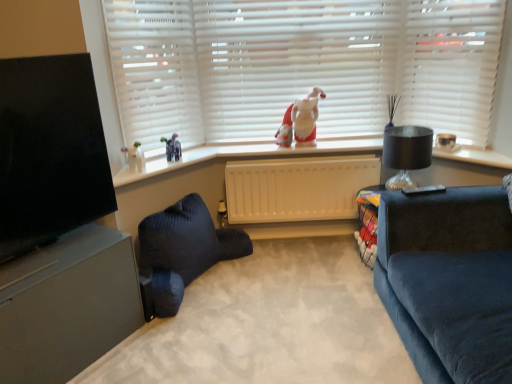
What do you see at coordinates (452, 66) in the screenshot? The width and height of the screenshot is (512, 384). I see `white matte blinds at upper center, which is counted as the second blind, starting from the left` at bounding box center [452, 66].

The height and width of the screenshot is (384, 512). I want to click on dark blue fabric studio couch at lower center, so click(x=182, y=252).

The image size is (512, 384). What do you see at coordinates (182, 252) in the screenshot?
I see `dark blue fabric studio couch at lower center` at bounding box center [182, 252].

Locate an element on the screen. white fabric santa at center is located at coordinates (300, 120).

What do you see at coordinates (297, 188) in the screenshot? I see `beige plastic radiator at center` at bounding box center [297, 188].

What are the coordinates of `white matte blinds at upper center, the first blind from the right` in the screenshot? It's located at (452, 66).

Is point (137, 108) farther from viewer compared to point (189, 331)?

Yes.

Between white matte blinds at upper left and velvet dark blue pillow at lower left, which one appears on the right side from the viewer's perspective?

Positioned to the right is velvet dark blue pillow at lower left.

Are white matte blinds at upper left and velvet dark blue pillow at lower left located far from each other?

Yes, white matte blinds at upper left and velvet dark blue pillow at lower left are located far from each other.

Based on the photo, relative to velvet dark blue pillow at lower left, is white matte blinds at upper left in front or behind?

Visually, white matte blinds at upper left is located behind velvet dark blue pillow at lower left.

Is white matte blinds at upper center, the first blind from the right, next to velvet dark blue pillow at lower left?

No, white matte blinds at upper center, the first blind from the right, is not with velvet dark blue pillow at lower left.

Between white matte blinds at upper center, which is counted as the second blind, starting from the left, and velvet dark blue pillow at lower left, which one has more height?

white matte blinds at upper center, which is counted as the second blind, starting from the left.

Considering the sizes of white matte blinds at upper center, the first blind from the right, and velvet dark blue pillow at lower left in the image, is white matte blinds at upper center, the first blind from the right, bigger or smaller than velvet dark blue pillow at lower left?

Considering their sizes, white matte blinds at upper center, the first blind from the right, takes up less space than velvet dark blue pillow at lower left.

Is there a large distance between dark blue fabric studio couch at lower center and black glass lampshade at right?

Yes.

Can you confirm if dark blue fabric studio couch at lower center is positioned to the left of black glass lampshade at right?

Yes.

Is black glossy tv at left far from matte gray entertainment center at lower left?

They are positioned close to each other.

Which is in front, black glossy tv at left or matte gray entertainment center at lower left?

black glossy tv at left is more forward.

Is matte gray entertainment center at lower left surrounded by black glossy tv at left?

No, matte gray entertainment center at lower left is not a part of black glossy tv at left.

Identify the location of toy located behind the white matte blinds at upper center, which is counted as the second blind, starting from the left. The width and height of the screenshot is (512, 384). (300, 120).

Is white matte blinds at upper center, which is counted as the second blind, starting from the left, far from white fabric santa at center?

No, there isn't a large distance between white matte blinds at upper center, which is counted as the second blind, starting from the left, and white fabric santa at center.

Can you tell me how much white matte blinds at upper center, the first blind from the right, and white fabric santa at center differ in facing direction?

white matte blinds at upper center, the first blind from the right, and white fabric santa at center are facing 47.3 degrees away from each other.

Is white matte blinds at upper center, which is counted as the second blind, starting from the left, bigger or smaller than white fabric santa at center?

In the image, white matte blinds at upper center, which is counted as the second blind, starting from the left, appears to be larger than white fabric santa at center.

Is matte black table at right outside of white fabric santa at center?

matte black table at right is positioned outside white fabric santa at center.

In terms of width, does matte black table at right look wider or thinner when compared to white fabric santa at center?

In the image, matte black table at right appears to be wider than white fabric santa at center.

The height and width of the screenshot is (384, 512). In order to click on table below the white fabric santa at center (from the image's perspective) in this screenshot , I will do `click(368, 222)`.

Is matte black table at right to the right of white fabric santa at center from the viewer's perspective?

Indeed, matte black table at right is positioned on the right side of white fabric santa at center.

Are white glossy window sill at upper center and white fabric santa at center located far from each other?

They are positioned close to each other.

Which point is more forward, (507, 163) or (284, 141)?

Point (507, 163)

In terms of height, does white glossy window sill at upper center look taller or shorter compared to white fabric santa at center?

Considering their sizes, white glossy window sill at upper center has less height than white fabric santa at center.

Looking at this image, which of these two, white glossy window sill at upper center or white fabric santa at center, is wider?

Wider between the two is white glossy window sill at upper center.

Where is `shutter above the velvet dark blue pillow at lower left (from the image's perspective)`? The width and height of the screenshot is (512, 384). shutter above the velvet dark blue pillow at lower left (from the image's perspective) is located at coordinates (154, 70).

In order to click on plain below the white matte blinds at upper center, the first blind from the right (from a real-world perspective) in this screenshot , I will do `click(269, 324)`.

Estimate the real-world distances between objects in this image. Which object is further from white matte blinds at upper left, white matte blinds at upper center, the first blind in the left-to-right sequence, or white glossy window sill at upper center?

white glossy window sill at upper center is further to white matte blinds at upper left.

From the image, which object appears to be nearer to white matte blinds at upper left, velvet dark blue pillow at lower left or matte gray entertainment center at lower left?

matte gray entertainment center at lower left.

When comparing their distances from white fabric santa at center, does velvet dark blue pillow at lower left or black glass lampshade at right seem closer?

black glass lampshade at right lies closer to white fabric santa at center than the other object.

Considering their positions, is dark blue fabric studio couch at lower center positioned closer to velvet dark blue pillow at lower left than matte black table at right?

dark blue fabric studio couch at lower center is closer to velvet dark blue pillow at lower left.

Considering their positions, is beige plastic radiator at center positioned further to black glass lampshade at right than white matte blinds at upper center, the first blind in the left-to-right sequence?

white matte blinds at upper center, the first blind in the left-to-right sequence, is positioned further to the anchor black glass lampshade at right.

Based on their spatial positions, is beige plastic radiator at center or white fabric santa at center closer to white matte blinds at upper center, which is counted as the second blind, starting from the left?

white fabric santa at center.

From the image, which object appears to be farther from matte gray entertainment center at lower left, white matte blinds at upper center, the second blind in the right-to-left sequence, or white matte blinds at upper left?

white matte blinds at upper center, the second blind in the right-to-left sequence, lies further to matte gray entertainment center at lower left than the other object.

Considering their positions, is white fabric santa at center positioned further to white matte blinds at upper left than velvet dark blue pillow at lower left?

The object further to white matte blinds at upper left is velvet dark blue pillow at lower left.

Locate an element on the screen. The width and height of the screenshot is (512, 384). studio couch between black glossy tv at left and beige plastic radiator at center in the front-back direction is located at coordinates (182, 252).

Locate an element on the screen. studio couch located between black glossy tv at left and white matte blinds at upper center, the first blind from the right, in the left-right direction is located at coordinates (182, 252).

Locate an element on the screen. The width and height of the screenshot is (512, 384). lamp that lies between white fabric santa at center and matte black table at right from top to bottom is located at coordinates (406, 153).

The image size is (512, 384). Identify the location of radiator between matte gray entertainment center at lower left and matte black table at right. (297, 188).